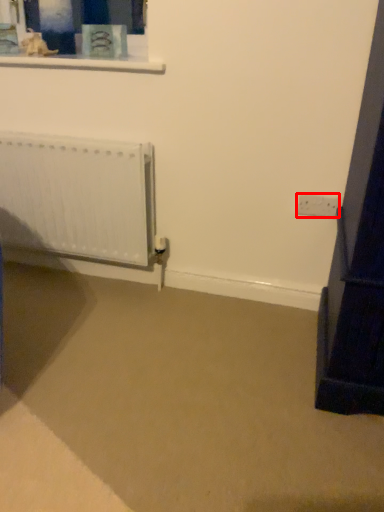
Question: From the image's perspective, what is the correct spatial relationship of electric outlet (annotated by the red box) in relation to radiator?

Choices:
 (A) below
 (B) above

Answer: (A)